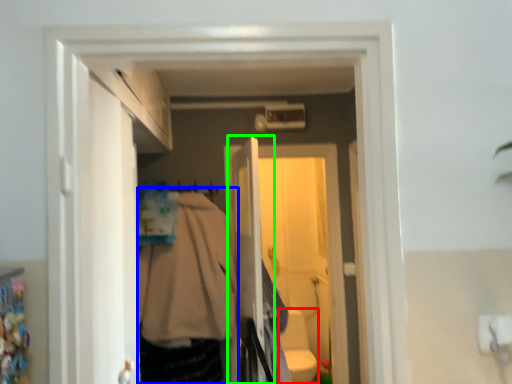
Question: Which object is positioned farthest from toilet bowl (highlighted by a red box)? Select from clothing (highlighted by a blue box) and screen door (highlighted by a green box).

Choices:
 (A) clothing
 (B) screen door

Answer: (B)